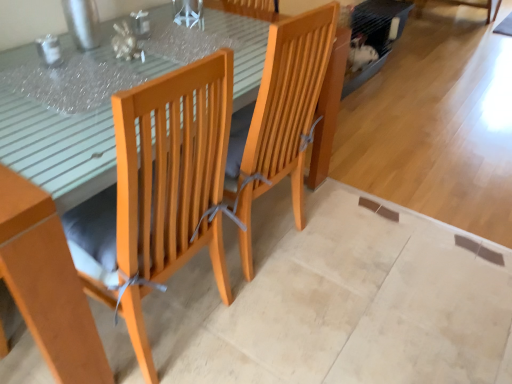
Question: Is wooden chair at center at the back of wooden table at center?

Choices:
 (A) yes
 (B) no

Answer: (A)

Question: From a real-world perspective, is wooden table at center under wooden chair at center?

Choices:
 (A) no
 (B) yes

Answer: (B)

Question: Is wooden table at center in front of wooden chair at center?

Choices:
 (A) no
 (B) yes

Answer: (B)

Question: Does wooden table at center appear on the left side of wooden chair at center?

Choices:
 (A) no
 (B) yes

Answer: (B)

Question: Can you confirm if wooden table at center is positioned to the right of wooden chair at center?

Choices:
 (A) yes
 (B) no

Answer: (B)

Question: Is wooden table at center bigger than wooden chair at center?

Choices:
 (A) yes
 (B) no

Answer: (A)

Question: From the image's perspective, is wooden chair at center under wooden table at center?

Choices:
 (A) yes
 (B) no

Answer: (B)

Question: Does wooden chair at center have a smaller size compared to wooden table at center?

Choices:
 (A) yes
 (B) no

Answer: (A)

Question: From the image's perspective, is wooden chair at center over wooden table at center?

Choices:
 (A) yes
 (B) no

Answer: (A)

Question: Considering the relative sizes of wooden chair at center and wooden table at center in the image provided, is wooden chair at center shorter than wooden table at center?

Choices:
 (A) no
 (B) yes

Answer: (A)

Question: Does wooden chair at center appear on the left side of wooden table at center?

Choices:
 (A) yes
 (B) no

Answer: (B)

Question: Is there a large distance between wooden chair at center and wooden table at center?

Choices:
 (A) yes
 (B) no

Answer: (B)

Question: Considering the positions of wooden table at center and wooden chair at center in the image, is wooden table at center taller or shorter than wooden chair at center?

Choices:
 (A) tall
 (B) short

Answer: (B)